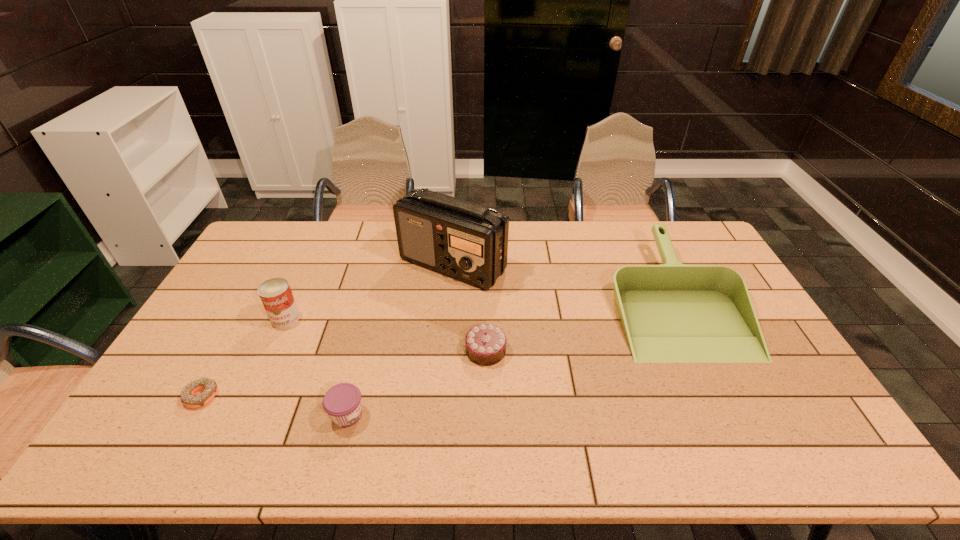
This screenshot has height=540, width=960. What are the coordinates of `free region located on the front label of the jam` in the screenshot? It's located at (453, 415).

Identify the location of blank space located 0.290m on the back of the chocolate cake. (485, 272).

The width and height of the screenshot is (960, 540). I want to click on free space located 0.050m on the left of the shortest object, so click(167, 395).

Where is `radio receiver that is at the far edge`? The width and height of the screenshot is (960, 540). radio receiver that is at the far edge is located at coordinates (468, 242).

Identify the location of dustpan at the far edge. The width and height of the screenshot is (960, 540). (672, 313).

Identify the location of object located at the near edge. [342, 402].

You are a GUI agent. You are given a task and a screenshot of the screen. Output one action in this format:
    pyautogui.click(x=<x>, y=<y>)
    Task: Click on the object present at the left edge
    
    Given the screenshot: What is the action you would take?
    pyautogui.click(x=188, y=399)

Identify the location of object that is at the right edge. This screenshot has width=960, height=540. (672, 313).

At what (x,y) coordinates should I click in order to perform the action: click on object at the far right corner. Please return your answer as a coordinate pair (x, y). The width and height of the screenshot is (960, 540). Looking at the image, I should click on (672, 313).

Find the location of `vacant position at the far edge of the desktop`. vacant position at the far edge of the desktop is located at coordinates (333, 249).